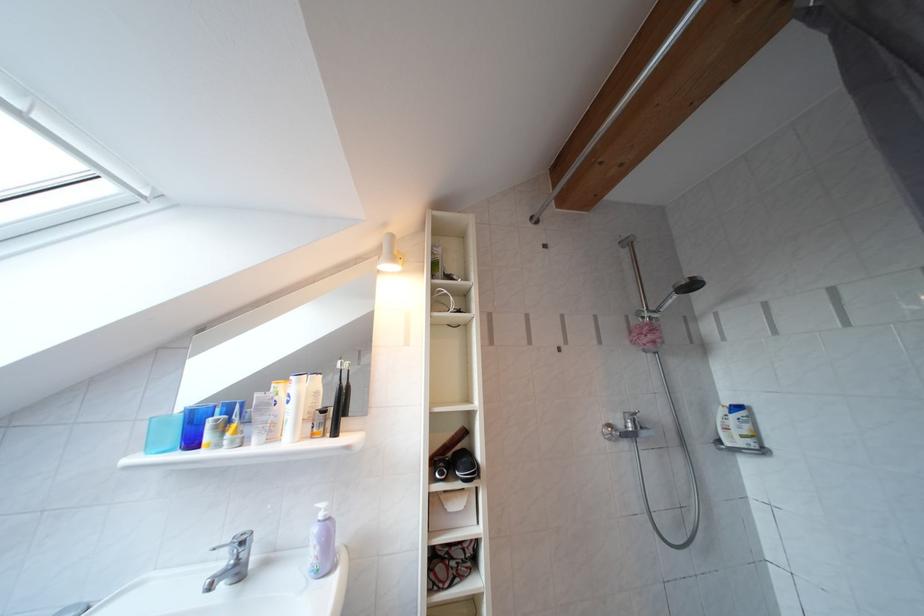
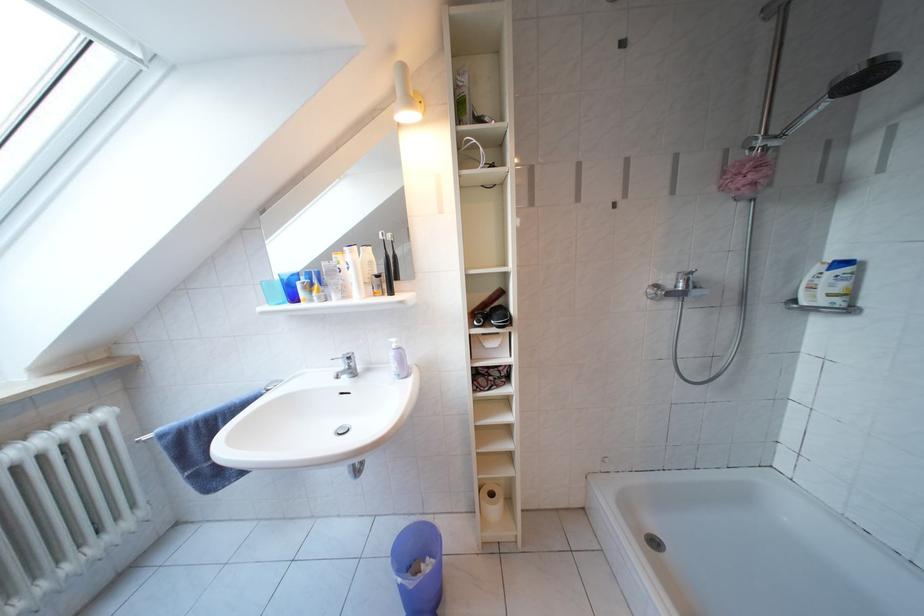
Locate, in the second image, the point that corresponds to point 233,565 in the first image.

(349, 371)